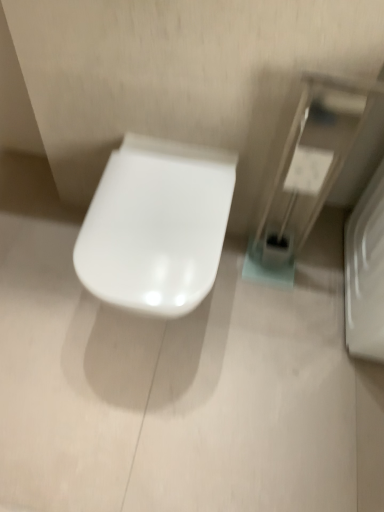
This screenshot has height=512, width=384. What do you see at coordinates (156, 226) in the screenshot?
I see `white glossy toilet at center` at bounding box center [156, 226].

This screenshot has height=512, width=384. Identify the location of white glossy toilet at center. tap(156, 226).

Find the location of `white glossy toilet at center`. white glossy toilet at center is located at coordinates (156, 226).